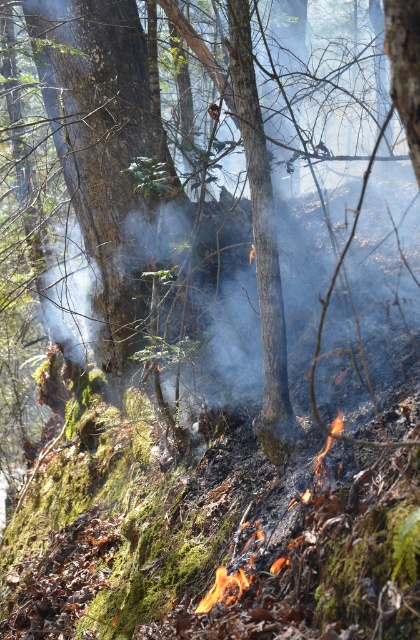
You are a firefighter assessing the fire scene. You notice the green mossy tree at center and the flaming charred debris at lower center. Which object is wider in terms of their physical dimensions?

The green mossy tree at center is wider than the flaming charred debris at lower center according to the description provided.

You are a firefighter assessing the fire scene. You notice the green mossy tree at center and the flaming charred debris at lower center. Based on their sizes, which one is more likely to be a potential fire hazard that needs immediate attention?

The flaming charred debris at lower center is more likely to be a potential fire hazard that needs immediate attention because it is smaller than the green mossy tree at center.

You are a firefighter assessing the fire scene. The green mossy tree at center is crucial for the ecosystem. Can you safely approach it from the flaming charred debris at lower center without crossing the fire zone? The fire zone has a radius of 3 meters.

The distance between the green mossy tree at center and the flaming charred debris at lower center is 4.09 meters. Since the fire zone has a radius of 3 meters, the tree is just outside the danger zone. You can safely approach the tree from the debris without entering the fire zone.